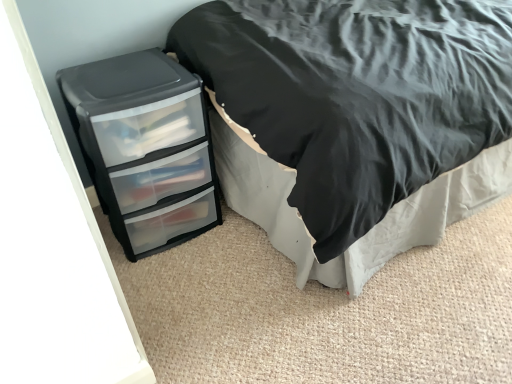
Question: Considering the positions of black matte bed at left and black plastic chest of drawers at lower left in the image, is black matte bed at left bigger or smaller than black plastic chest of drawers at lower left?

Choices:
 (A) small
 (B) big

Answer: (B)

Question: From their relative heights in the image, would you say black matte bed at left is taller or shorter than black plastic chest of drawers at lower left?

Choices:
 (A) short
 (B) tall

Answer: (B)

Question: From the image's perspective, relative to black plastic chest of drawers at lower left, is black matte bed at left above or below?

Choices:
 (A) above
 (B) below

Answer: (A)

Question: From the image's perspective, is black plastic chest of drawers at lower left above or below black matte bed at left?

Choices:
 (A) above
 (B) below

Answer: (B)

Question: From a real-world perspective, is black plastic chest of drawers at lower left physically located above or below black matte bed at left?

Choices:
 (A) above
 (B) below

Answer: (B)

Question: In the image, is black plastic chest of drawers at lower left on the left side or the right side of black matte bed at left?

Choices:
 (A) left
 (B) right

Answer: (A)

Question: Looking at their shapes, would you say black plastic chest of drawers at lower left is wider or thinner than black matte bed at left?

Choices:
 (A) thin
 (B) wide

Answer: (A)